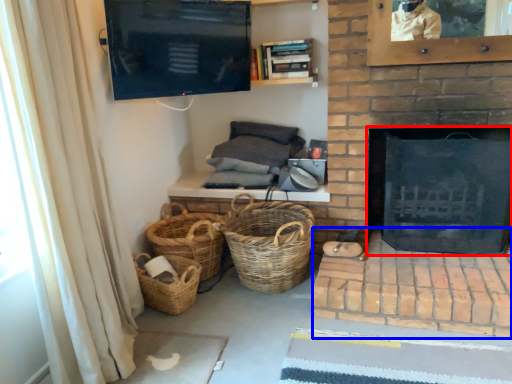
Question: Among these objects, which one is nearest to the camera, fireplace (highlighted by a red box) or brickwork (highlighted by a blue box)?

Choices:
 (A) fireplace
 (B) brickwork

Answer: (B)